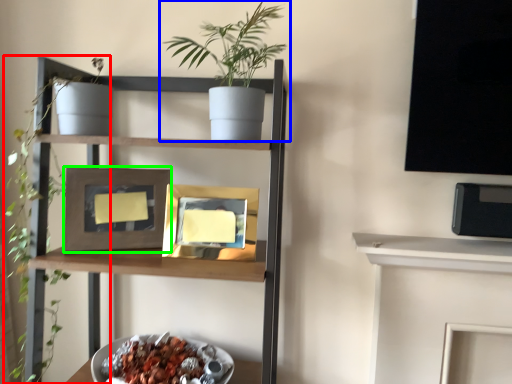
Question: Considering the real-world distances, which object is closest to plant (highlighted by a red box)? houseplant (highlighted by a blue box) or picture frame (highlighted by a green box).

Choices:
 (A) houseplant
 (B) picture frame

Answer: (B)